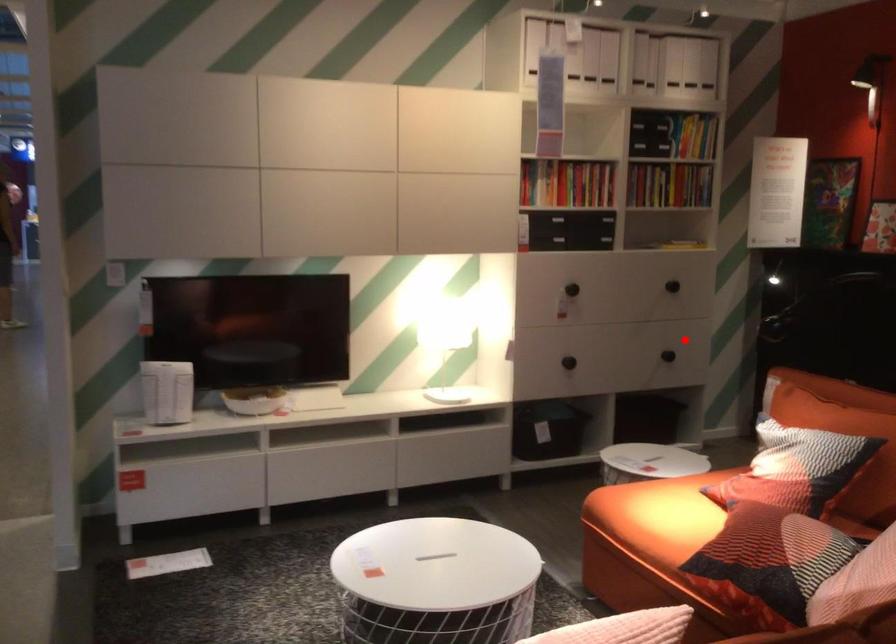
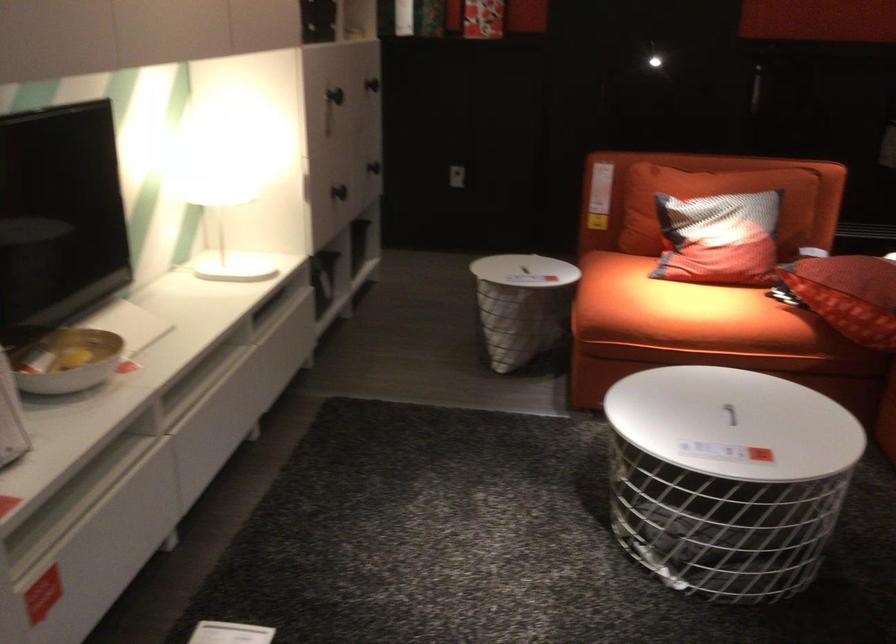
In the second image, find the point that corresponds to the highlighted location in the first image.

(373, 167)